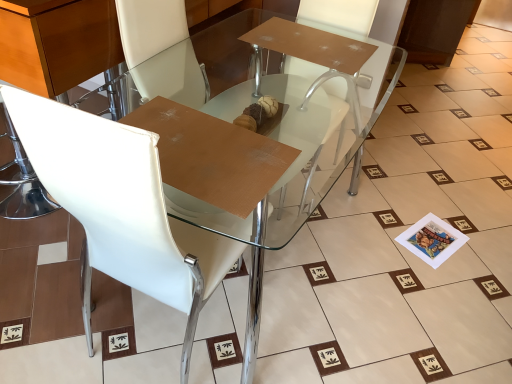
This screenshot has height=384, width=512. I want to click on white leather chair at upper left, so click(x=121, y=207).

What is the approximate width of white leather armchair at center?

It is 51.65 centimeters.

This screenshot has height=384, width=512. I want to click on transparent glass table at center, so click(x=272, y=143).

At what (x,y) coordinates should I click in order to perform the action: click on white leather chair at upper left. Please return your answer as a coordinate pair (x, y). The width and height of the screenshot is (512, 384). Looking at the image, I should click on (121, 207).

From a real-world perspective, is white leather armchair at center below transparent glass table at center?

No, from a real-world perspective, white leather armchair at center is not under transparent glass table at center.

From the picture: Are white leather armchair at center and transparent glass table at center making contact?

No, white leather armchair at center is not beside transparent glass table at center.

Who is taller, white leather armchair at center or transparent glass table at center?

Standing taller between the two is white leather armchair at center.

What's the angular difference between transparent glass table at center and white leather armchair at center's facing directions?

transparent glass table at center and white leather armchair at center are facing 90 degrees away from each other.

Is transparent glass table at center placed right next to white leather armchair at center?

transparent glass table at center and white leather armchair at center are clearly separated.

Consider the image. Considering the relative positions of transparent glass table at center and white leather armchair at center in the image provided, is transparent glass table at center in front of white leather armchair at center?

Yes, it is.

Considering the relative positions of transparent glass table at center and white leather armchair at center in the image provided, is transparent glass table at center to the right of white leather armchair at center from the viewer's perspective?

Incorrect, transparent glass table at center is not on the right side of white leather armchair at center.

Which of these two, transparent glass table at center or white leather chair at upper left, is thinner?

white leather chair at upper left is thinner.

From a real-world perspective, is transparent glass table at center under white leather chair at upper left?

Yes, from a real-world perspective, transparent glass table at center is beneath white leather chair at upper left.

Which is closer, [212,134] or [115,185]?

The point [115,185] is more forward.

Looking at this image, based on their sizes in the image, would you say transparent glass table at center is bigger or smaller than white leather chair at upper left?

Considering their sizes, transparent glass table at center takes up more space than white leather chair at upper left.

Is white leather chair at upper left inside or outside of transparent glass table at center?

white leather chair at upper left is inside transparent glass table at center.

From a real-world perspective, who is located higher, white leather chair at upper left or transparent glass table at center?

white leather chair at upper left, from a real-world perspective.

Which object is closer to the camera taking this photo, white leather chair at upper left or transparent glass table at center?

white leather chair at upper left is in front.

Is point (89, 140) less distant than point (359, 71)?

Yes, point (89, 140) is closer to viewer.

Can you confirm if white leather chair at upper left is bigger than white leather armchair at center?

Yes.

Is point (132, 244) closer or farther from the camera than point (276, 23)?

Point (132, 244) is positioned closer to the camera compared to point (276, 23).

From the picture: Considering the relative sizes of white leather chair at upper left and white leather armchair at center in the image provided, is white leather chair at upper left taller than white leather armchair at center?

Correct, white leather chair at upper left is much taller as white leather armchair at center.

Is white leather chair at upper left completely or partially outside of white leather armchair at center?

Yes, white leather chair at upper left is located beyond the bounds of white leather armchair at center.

What's the angular difference between white leather armchair at center and white leather chair at upper left's facing directions?

white leather armchair at center and white leather chair at upper left are facing 3.3 degrees away from each other.

In the scene shown: Which point is more forward, [294,47] or [46,120]?

The point [46,120] is closer to the camera.

Would you say white leather armchair at center is inside or outside white leather chair at upper left?

white leather armchair at center is outside white leather chair at upper left.

Is white leather armchair at center in front of or behind white leather chair at upper left in the image?

Clearly, white leather armchair at center is behind white leather chair at upper left.

The height and width of the screenshot is (384, 512). In order to click on round table in front of the white leather armchair at center in this screenshot , I will do `click(272, 143)`.

You are a GUI agent. You are given a task and a screenshot of the screen. Output one action in this format:
    pyautogui.click(x=<x>, y=<y>)
    Task: Click on the armchair lying behind the transparent glass table at center
    
    Given the screenshot: What is the action you would take?
    pyautogui.click(x=314, y=57)

Estimate the real-world distances between objects in this image. Which object is further from white leather chair at upper left, transparent glass table at center or white leather armchair at center?

Among the two, white leather armchair at center is located further to white leather chair at upper left.

When comparing their distances from white leather chair at upper left, does white leather armchair at center or transparent glass table at center seem closer?

transparent glass table at center is positioned closer to the anchor white leather chair at upper left.

From the image, which object appears to be farther from white leather armchair at center, white leather chair at upper left or transparent glass table at center?

white leather chair at upper left lies further to white leather armchair at center than the other object.

Looking at the image, which one is located further to transparent glass table at center, white leather chair at upper left or white leather armchair at center?

The object further to transparent glass table at center is white leather chair at upper left.

Estimate the real-world distances between objects in this image. Which object is closer to transparent glass table at center, white leather armchair at center or white leather chair at upper left?

Based on the image, white leather armchair at center appears to be nearer to transparent glass table at center.

Based on their spatial positions, is transparent glass table at center or white leather chair at upper left further from white leather armchair at center?

Based on the image, white leather chair at upper left appears to be further to white leather armchair at center.

Locate an element on the screen. round table between white leather chair at upper left and white leather armchair at center along the z-axis is located at coordinates (272, 143).